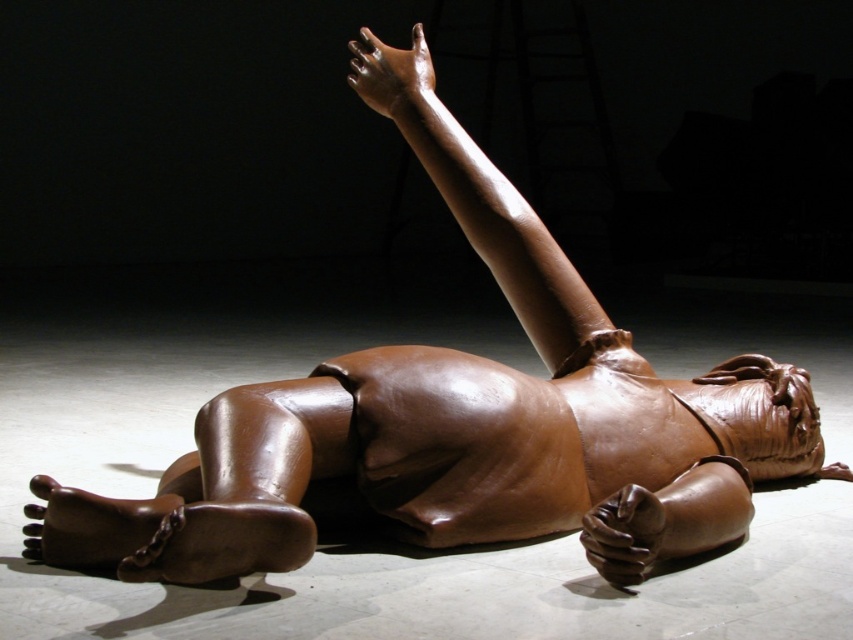
Can you confirm if shiny brown hand at upper center is positioned to the right of shiny brown hand at lower right?

Incorrect, shiny brown hand at upper center is not on the right side of shiny brown hand at lower right.

Looking at this image, who is positioned more to the right, shiny brown hand at upper center or shiny brown hand at lower right?

From the viewer's perspective, shiny brown hand at lower right appears more on the right side.

Locate an element on the screen. shiny brown hand at upper center is located at coordinates (393, 77).

Does shiny brown arm at upper center have a greater width compared to shiny brown hand at upper center?

Indeed, shiny brown arm at upper center has a greater width compared to shiny brown hand at upper center.

Is point (358, 44) farther from viewer compared to point (407, 67)?

Yes, it is.

What do you see at coordinates (479, 196) in the screenshot? I see `shiny brown arm at upper center` at bounding box center [479, 196].

This screenshot has height=640, width=853. In order to click on shiny brown arm at upper center in this screenshot , I will do tap(479, 196).

Is shiny brown arm at upper center wider than shiny brown hand at lower right?

Yes, shiny brown arm at upper center is wider than shiny brown hand at lower right.

Between shiny brown arm at upper center and shiny brown hand at lower right, which one appears on the right side from the viewer's perspective?

Positioned to the right is shiny brown hand at lower right.

Describe the element at coordinates (479, 196) in the screenshot. The width and height of the screenshot is (853, 640). I see `shiny brown arm at upper center` at that location.

Where is `shiny brown arm at upper center`? The image size is (853, 640). shiny brown arm at upper center is located at coordinates (479, 196).